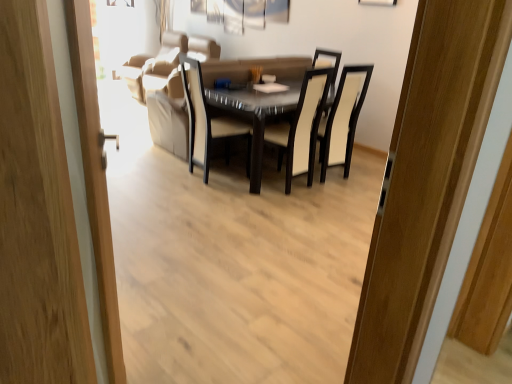
Question: Is glossy glass table at center positioned in front of black leather chair at center, arranged as the 2th chair when viewed from the left?

Choices:
 (A) no
 (B) yes

Answer: (B)

Question: Is glossy glass table at center to the left of black leather chair at center, the first chair from the right, from the viewer's perspective?

Choices:
 (A) yes
 (B) no

Answer: (A)

Question: Considering the relative sizes of glossy glass table at center and black leather chair at center, the first chair from the right, in the image provided, is glossy glass table at center shorter than black leather chair at center, the first chair from the right,?

Choices:
 (A) no
 (B) yes

Answer: (B)

Question: Considering the relative positions of glossy glass table at center and black leather chair at center, the first chair from the right, in the image provided, is glossy glass table at center to the right of black leather chair at center, the first chair from the right, from the viewer's perspective?

Choices:
 (A) no
 (B) yes

Answer: (A)

Question: From the image's perspective, is glossy glass table at center on top of black leather chair at center, the first chair from the right?

Choices:
 (A) yes
 (B) no

Answer: (B)

Question: From the image's perspective, is wooden door at left located above or below glossy glass table at center?

Choices:
 (A) above
 (B) below

Answer: (B)

Question: Relative to glossy glass table at center, is wooden door at left in front or behind?

Choices:
 (A) front
 (B) behind

Answer: (A)

Question: Based on their sizes in the image, would you say wooden door at left is bigger or smaller than glossy glass table at center?

Choices:
 (A) small
 (B) big

Answer: (A)

Question: Does point (117, 347) appear closer or farther from the camera than point (190, 157)?

Choices:
 (A) farther
 (B) closer

Answer: (B)

Question: Is suede beige couch at upper center situated inside glossy glass table at center or outside?

Choices:
 (A) inside
 (B) outside

Answer: (B)

Question: In the image, is suede beige couch at upper center positioned in front of or behind glossy glass table at center?

Choices:
 (A) behind
 (B) front

Answer: (A)

Question: From a real-world perspective, is suede beige couch at upper center positioned above or below glossy glass table at center?

Choices:
 (A) below
 (B) above

Answer: (B)

Question: Considering the positions of point (167, 51) and point (258, 134), is point (167, 51) closer or farther from the camera than point (258, 134)?

Choices:
 (A) closer
 (B) farther

Answer: (B)

Question: Would you say black leather chair at center, the first chair from the right, is to the left or to the right of beige fabric chair at center, placed as the second chair when sorted from right to left, in the picture?

Choices:
 (A) right
 (B) left

Answer: (A)

Question: In terms of height, does black leather chair at center, the first chair from the right, look taller or shorter compared to beige fabric chair at center, placed as the second chair when sorted from right to left?

Choices:
 (A) short
 (B) tall

Answer: (A)